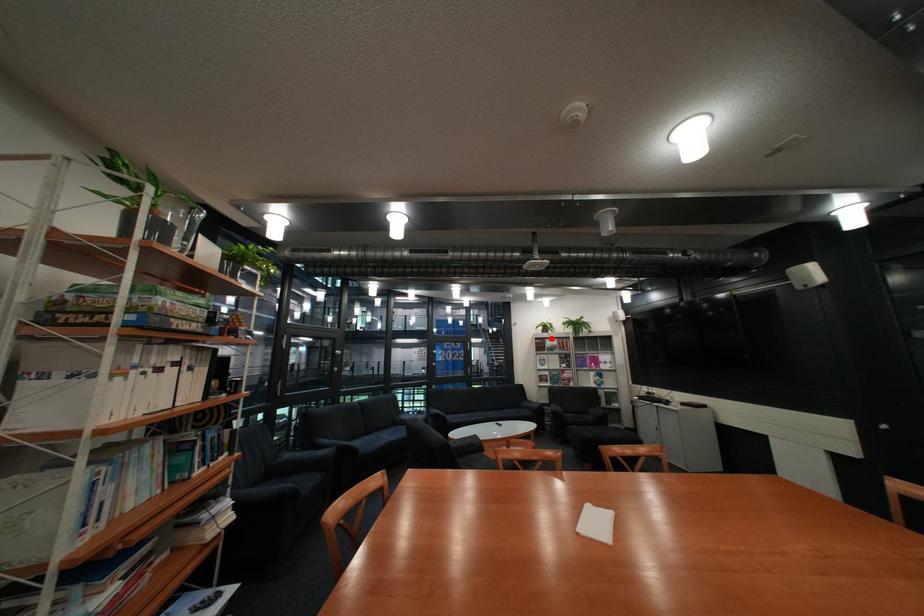
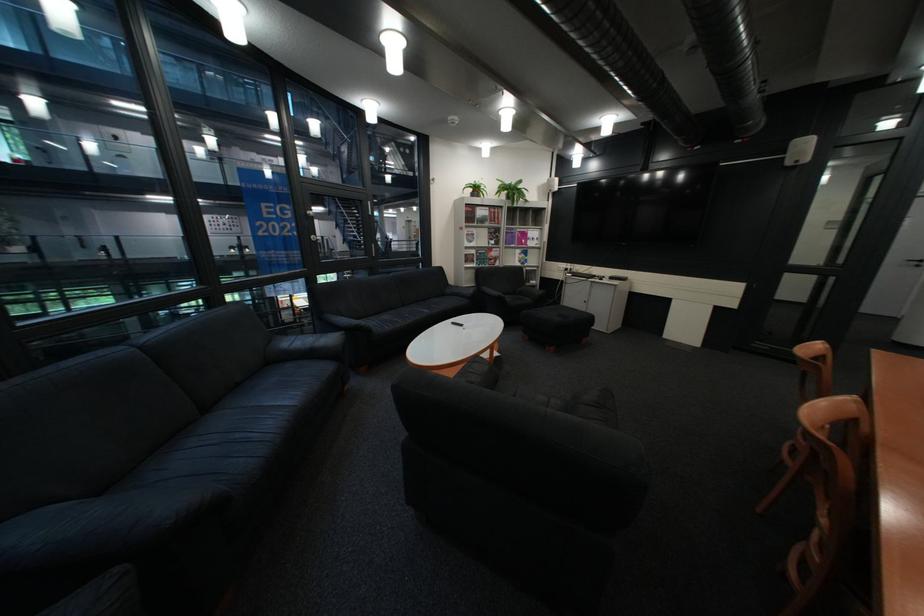
Question: I am providing you with two images of the same scene from different viewpoints. In image1, a red point is highlighted. Considering the same 3D point in image2, which of the following is correct?

Choices:
 (A) It is closer
 (B) It is farther

Answer: (A)